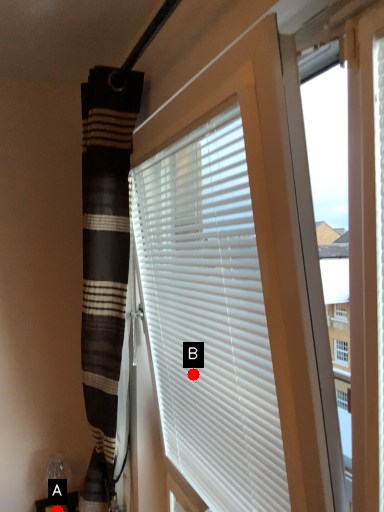
Question: Two points are circled on the image, labeled by A and B beside each circle. Which point is further to the camera?

Choices:
 (A) A is further
 (B) B is further

Answer: (A)